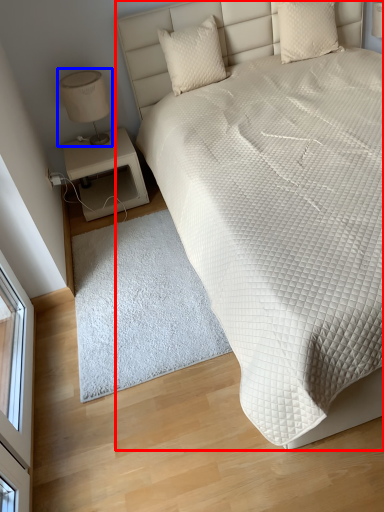
Question: Which point is further to the camera, bed (highlighted by a red box) or table lamp (highlighted by a blue box)?

Choices:
 (A) bed
 (B) table lamp

Answer: (B)